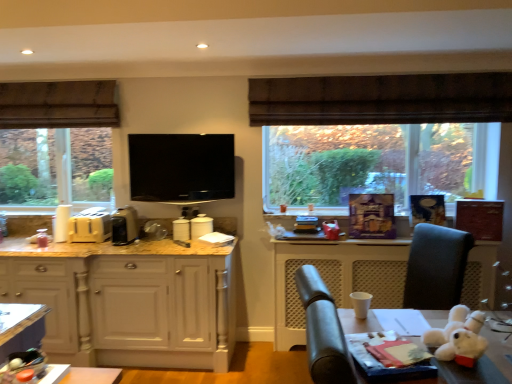
Question: Does black glossy tv at center have a greater height compared to white paper at lower right?

Choices:
 (A) yes
 (B) no

Answer: (B)

Question: Could white paper at lower right be considered to be inside black glossy tv at center?

Choices:
 (A) yes
 (B) no

Answer: (B)

Question: Does black glossy tv at center have a larger size compared to white paper at lower right?

Choices:
 (A) no
 (B) yes

Answer: (A)

Question: From a real-world perspective, is black glossy tv at center positioned over white paper at lower right based on gravity?

Choices:
 (A) yes
 (B) no

Answer: (A)

Question: Is black glossy tv at center not close to white paper at lower right?

Choices:
 (A) no
 (B) yes

Answer: (A)

Question: Relative to white plush toy at lower right, is brown fabric exhaust hood at upper left in front or behind?

Choices:
 (A) front
 (B) behind

Answer: (B)

Question: In terms of size, does brown fabric exhaust hood at upper left appear bigger or smaller than white plush toy at lower right?

Choices:
 (A) big
 (B) small

Answer: (A)

Question: Is brown fabric exhaust hood at upper left situated inside white plush toy at lower right or outside?

Choices:
 (A) outside
 (B) inside

Answer: (A)

Question: Would you say brown fabric exhaust hood at upper left is to the left or to the right of white plush toy at lower right in the picture?

Choices:
 (A) right
 (B) left

Answer: (B)

Question: In the image, is matte white table at lower left positioned in front of or behind white glossy toaster at center, the 3th appliance viewed from the left?

Choices:
 (A) behind
 (B) front

Answer: (B)

Question: Considering the positions of matte white table at lower left and white glossy toaster at center, the 3th appliance viewed from the left, in the image, is matte white table at lower left taller or shorter than white glossy toaster at center, the 3th appliance viewed from the left,?

Choices:
 (A) tall
 (B) short

Answer: (B)

Question: From a real-world perspective, is matte white table at lower left positioned above or below white glossy toaster at center, which is counted as the second appliance, starting from the right?

Choices:
 (A) above
 (B) below

Answer: (B)

Question: From the image's perspective, relative to white glossy toaster at center, which is counted as the second appliance, starting from the right, is matte white table at lower left above or below?

Choices:
 (A) above
 (B) below

Answer: (B)

Question: Considering the relative positions of matte yellow toaster at left, positioned as the first appliance in left-to-right order, and white plush toy at lower right in the image provided, is matte yellow toaster at left, positioned as the first appliance in left-to-right order, to the left or to the right of white plush toy at lower right?

Choices:
 (A) right
 (B) left

Answer: (B)

Question: Is matte yellow toaster at left, the fourth appliance viewed from the right, bigger or smaller than white plush toy at lower right?

Choices:
 (A) small
 (B) big

Answer: (B)